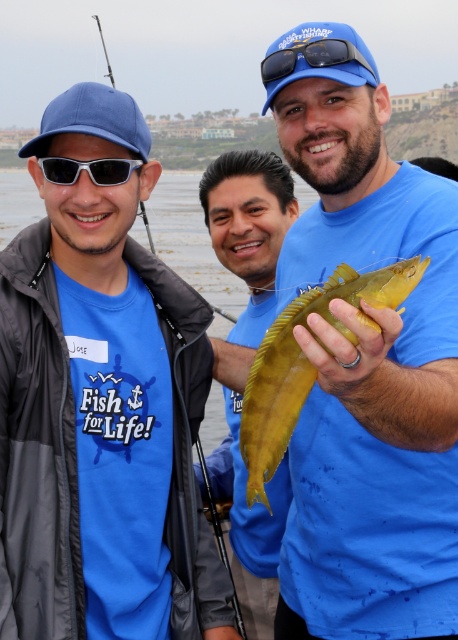
Question: Which point is farther to the camera?

Choices:
 (A) (299, 48)
 (B) (124, 168)
 (C) (232, 480)

Answer: (C)

Question: Which of these objects is positioned farthest from the matte yellow fish at center?

Choices:
 (A) yellow-green scaley fish at center
 (B) yellow matte fish at center

Answer: (A)

Question: Where is matte blue t-shirt at center located in relation to blue matte sunglasses at upper center in the image?

Choices:
 (A) right
 (B) left

Answer: (B)

Question: Estimate the real-world distances between objects in this image. Which object is closer to the yellow-green scaley fish at center?

Choices:
 (A) matte yellow fish at center
 (B) matte blue t-shirt at center

Answer: (A)

Question: Is matte blue t-shirt at center thinner than matte yellow fish at center?

Choices:
 (A) no
 (B) yes

Answer: (A)

Question: Can you confirm if matte yellow fish at center is bigger than yellow matte fish at center?

Choices:
 (A) no
 (B) yes

Answer: (B)